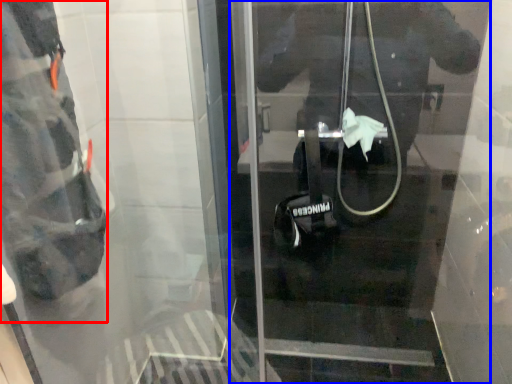
Question: Among these objects, which one is nearest to the camera, wide (highlighted by a red box) or door (highlighted by a blue box)?

Choices:
 (A) wide
 (B) door

Answer: (B)